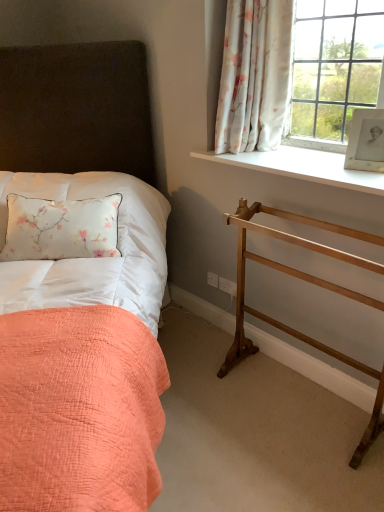
Question: Based on their sizes in the image, would you say matte fabric bed at left is bigger or smaller than wooden balustrade at right?

Choices:
 (A) big
 (B) small

Answer: (A)

Question: From the image's perspective, is matte fabric bed at left located above or below wooden balustrade at right?

Choices:
 (A) below
 (B) above

Answer: (B)

Question: Which object is positioned farthest from the floral fabric curtain at upper right?

Choices:
 (A) white smooth window sill at upper right
 (B) white quilted fabric at upper left
 (C) white paper photo frame at upper right
 (D) wooden balustrade at right
 (E) matte fabric bed at left

Answer: (B)

Question: Which is farther from the white smooth window sill at upper right?

Choices:
 (A) matte fabric bed at left
 (B) wooden balustrade at right
 (C) floral fabric curtain at upper right
 (D) white quilted fabric at upper left
 (E) white paper photo frame at upper right

Answer: (A)